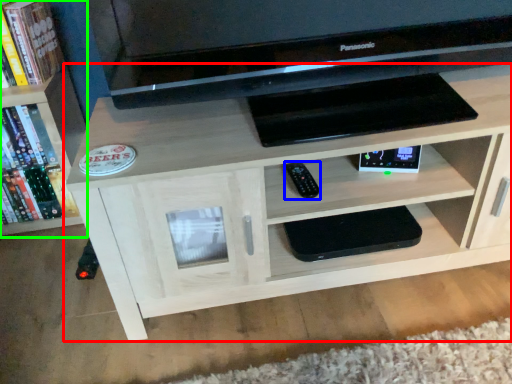
Question: Which object is positioned farthest from shelf (highlighted by a red box)? Select from remote (highlighted by a blue box) and bookcase (highlighted by a green box).

Choices:
 (A) remote
 (B) bookcase

Answer: (B)